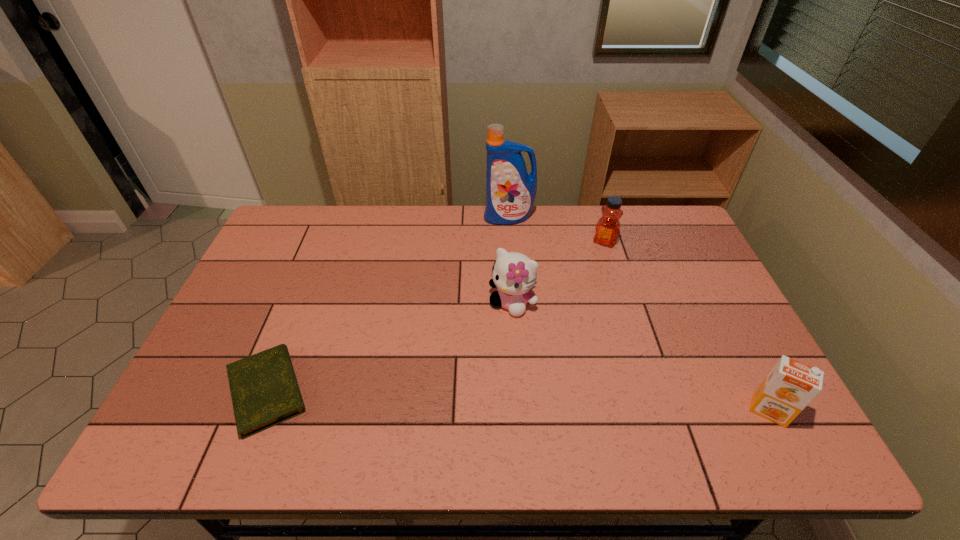
Identify the location of the shortest object. (264, 389).

Find the location of a particular element. This screenshot has width=960, height=540. diary is located at coordinates (264, 389).

The image size is (960, 540). I want to click on orange juice, so click(790, 386).

I want to click on kitten, so click(x=514, y=274).

This screenshot has width=960, height=540. In order to click on the fourth nearest object in this screenshot , I will do `click(607, 228)`.

Where is `the fourth object from left to right`? the fourth object from left to right is located at coordinates (607, 228).

Locate an element on the screen. The height and width of the screenshot is (540, 960). the tallest object is located at coordinates pos(510,190).

In order to click on the farthest object in this screenshot , I will do `click(510, 190)`.

Find the location of a particular element. The width and height of the screenshot is (960, 540). free spot located 0.050m on the left of the shortest object is located at coordinates (200, 390).

Locate an element on the screen. The width and height of the screenshot is (960, 540). free region located on the back of the orange juice is located at coordinates (x=704, y=283).